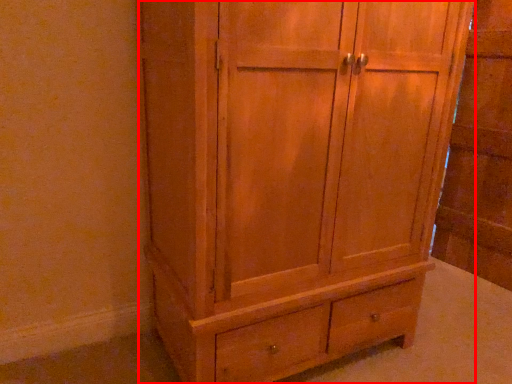
Question: From the image's perspective, considering the relative positions of cupboard (annotated by the red box) and side cabinet in the image provided, where is cupboard (annotated by the red box) located with respect to the staircase?

Choices:
 (A) above
 (B) below

Answer: (B)